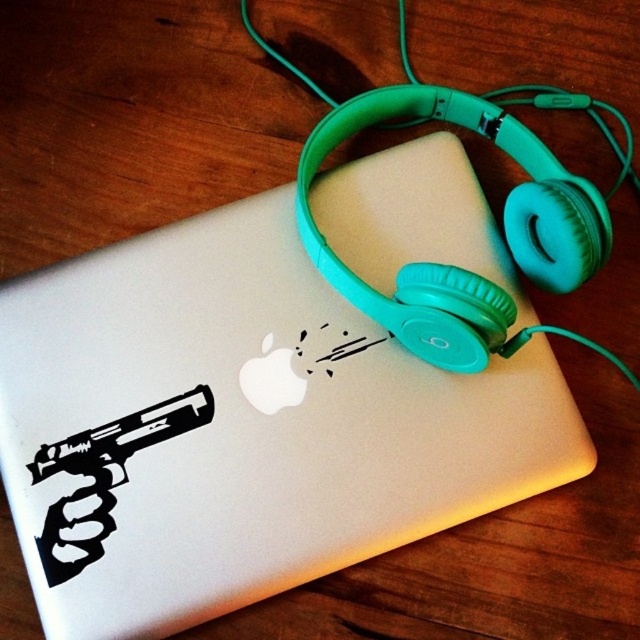
Is white matte laptop at center wider than black vinyl sticker at lower left?

Correct, the width of white matte laptop at center exceeds that of black vinyl sticker at lower left.

Is white matte laptop at center further to the viewer compared to black vinyl sticker at lower left?

No, it is in front of black vinyl sticker at lower left.

Does point (332, 484) lie in front of point (68, 547)?

No, it is behind (68, 547).

You are a GUI agent. You are given a task and a screenshot of the screen. Output one action in this format:
    pyautogui.click(x=<x>, y=<y>)
    Task: Click on the white matte laptop at center
    The image size is (640, 640).
    Given the screenshot: What is the action you would take?
    pyautogui.click(x=240, y=428)